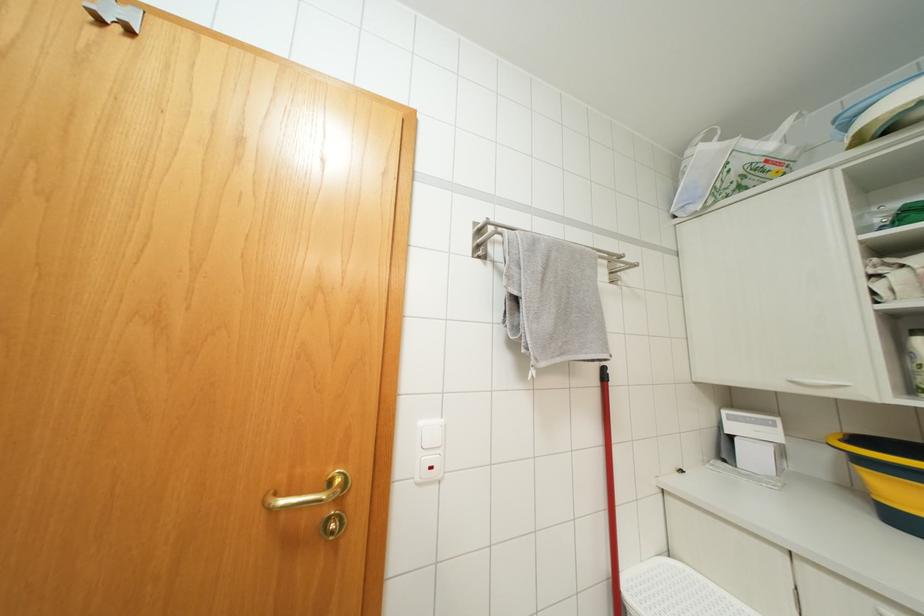
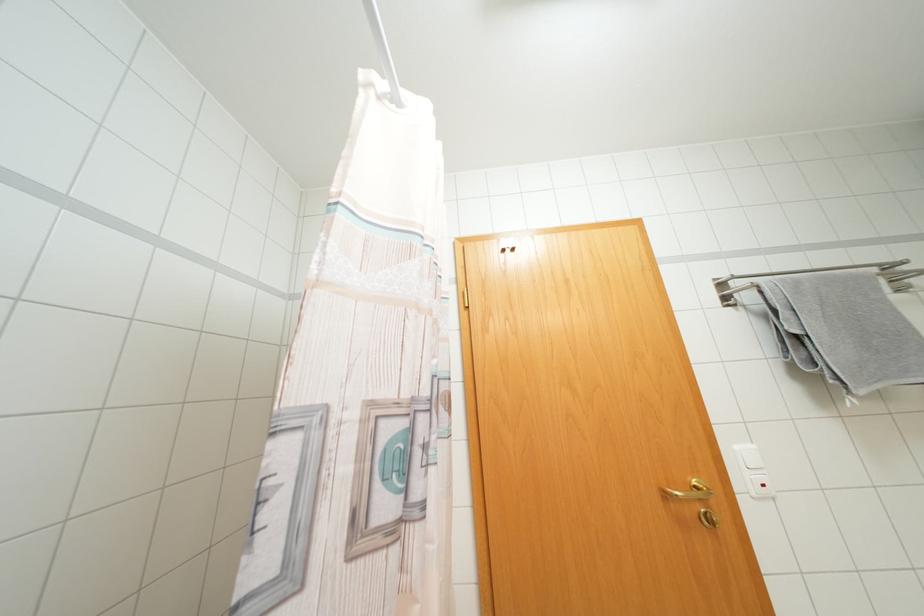
The point at (557, 360) is marked in the first image. Where is the corresponding point in the second image?

(877, 386)